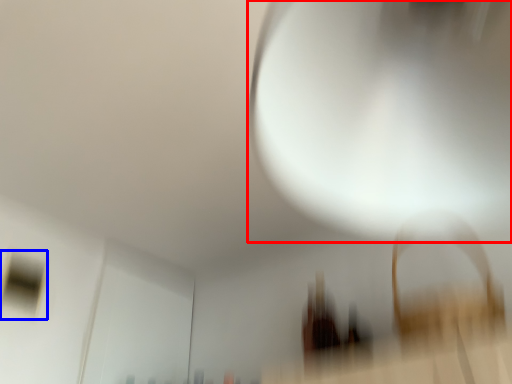
Question: Which object appears closest to the camera in this image, light (highlighted by a red box) or window (highlighted by a blue box)?

Choices:
 (A) light
 (B) window

Answer: (A)